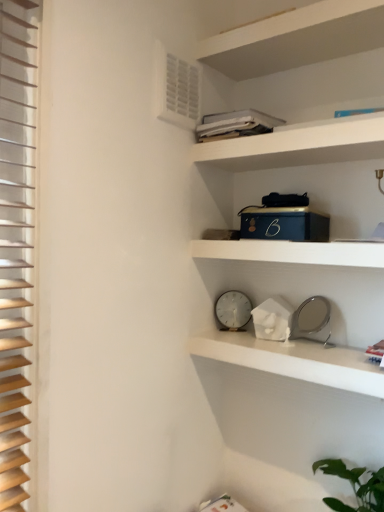
Question: Based on their positions, is white matte cabinet at upper center located to the left or right of white plastic clock at center?

Choices:
 (A) right
 (B) left

Answer: (A)

Question: Is white matte cabinet at upper center in front of or behind white plastic clock at center in the image?

Choices:
 (A) behind
 (B) front

Answer: (B)

Question: Which object is the closest to the white matte cabinet at upper center?

Choices:
 (A) white plastic clock at center
 (B) wooden blinds at left
 (C) white marble clock at center, the first shelf when ordered from bottom to top
 (D) white matte clock at center, which is the second shelf from bottom to top
 (E) white plastic air conditioning unit at upper left

Answer: (E)

Question: Which is farther from the white marble clock at center, the second shelf in the top-to-bottom sequence?

Choices:
 (A) white plastic clock at center
 (B) white plastic air conditioning unit at upper left
 (C) wooden blinds at left
 (D) white matte clock at center, positioned as the first shelf in top-to-bottom order
 (E) white matte cabinet at upper center

Answer: (B)